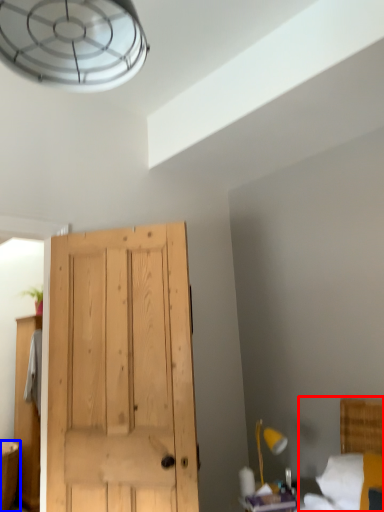
Question: Which point is closer to the camera, bed (highlighted by a red box) or vanity (highlighted by a blue box)?

Choices:
 (A) bed
 (B) vanity

Answer: (A)